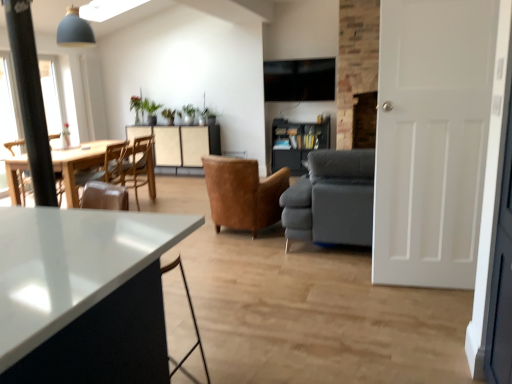
You are a GUI agent. You are given a task and a screenshot of the screen. Output one action in this format:
    pyautogui.click(x=<x>, y=<y>)
    Task: Click on the green leafy plant at center
    
    Given the screenshot: What is the action you would take?
    pyautogui.click(x=189, y=110)

I want to click on beige textured cabinet at center, so click(180, 143).

Describe the element at coordinates (104, 167) in the screenshot. I see `brown leather chair at left, positioned as the first chair in left-to-right order` at that location.

In order to face wooden chair at left, which ranks as the second chair in right-to-left order, should I rotate leftwards or rightwards?

You should look left and rotate roughly 16.334 degrees.

Where is `leather armchair at center, the third chair in the left-to-right sequence`? The width and height of the screenshot is (512, 384). leather armchair at center, the third chair in the left-to-right sequence is located at coordinates (243, 193).

This screenshot has height=384, width=512. In order to click on green leafy plant at center in this screenshot , I will do `click(189, 110)`.

From a real-world perspective, who is located lower, clear glass window at left or white matte door at right?

From a 3D spatial view, white matte door at right is below.

Is clear glass window at left surrounding white matte door at right?

That's incorrect, white matte door at right is not inside clear glass window at left.

Image resolution: width=512 pixels, height=384 pixels. Identify the location of window located above the white matte door at right (from a real-world perspective). (52, 93).

Is clear glass window at left at the left side of white matte door at right?

Yes.

In the scene shown: Could you tell me if clear glass window at left is facing dark wood bookshelf at center?

Yes.

Which is more to the right, clear glass window at left or dark wood bookshelf at center?

dark wood bookshelf at center.

Does point (59, 91) lie behind point (277, 122)?

No, it is not.

Is clear glass window at left directly adjacent to dark wood bookshelf at center?

No, clear glass window at left is not making contact with dark wood bookshelf at center.

Does point (135, 194) come closer to viewer compared to point (101, 178)?

Yes, it is.

Is wooden chair at left, which ranks as the second chair in right-to-left order, touching brown leather chair at left, positioned as the first chair in left-to-right order?

No, wooden chair at left, which ranks as the second chair in right-to-left order, is not next to brown leather chair at left, positioned as the first chair in left-to-right order.

Choose the correct answer: Is wooden chair at left, which ranks as the second chair in right-to-left order, inside brown leather chair at left, the 3th chair when ordered from right to left, or outside it?

wooden chair at left, which ranks as the second chair in right-to-left order, is not inside brown leather chair at left, the 3th chair when ordered from right to left, it's outside.

Is point (188, 112) less distant than point (175, 139)?

Yes, point (188, 112) is closer to viewer.

Is green leafy plant at center to the right of beige textured cabinet at center from the viewer's perspective?

Indeed, green leafy plant at center is positioned on the right side of beige textured cabinet at center.

How different are the orientations of green leafy plant at center and beige textured cabinet at center in degrees?

The angular difference between green leafy plant at center and beige textured cabinet at center is 1.93 degrees.

Locate an element on the screen. cabinetry that is under the green leafy plant at center (from a real-world perspective) is located at coordinates (180, 143).

Is point (138, 109) positioned after point (324, 134)?

No, it is in front of (324, 134).

From the image's perspective, is green matte plant at upper center located above or below dark wood bookshelf at center?

green matte plant at upper center is situated higher than dark wood bookshelf at center in the image.

Based on their sizes in the image, would you say green matte plant at upper center is bigger or smaller than dark wood bookshelf at center?

Considering their sizes, green matte plant at upper center takes up less space than dark wood bookshelf at center.

Which object is closer to the camera taking this photo, green matte plant at upper center or dark wood bookshelf at center?

Positioned in front is dark wood bookshelf at center.

Considering the positions of objects brown leather chair at left, positioned as the first chair in left-to-right order, and beige textured cabinet at center in the image provided, who is more to the right, brown leather chair at left, positioned as the first chair in left-to-right order, or beige textured cabinet at center?

Positioned to the right is beige textured cabinet at center.

Measure the distance from brown leather chair at left, the 3th chair when ordered from right to left, to beige textured cabinet at center.

brown leather chair at left, the 3th chair when ordered from right to left, is 1.53 meters from beige textured cabinet at center.

Find the location of a particular element. Image resolution: width=512 pixels, height=384 pixels. cabinetry behind the brown leather chair at left, positioned as the first chair in left-to-right order is located at coordinates (180, 143).

Considering the relative sizes of brown leather chair at left, positioned as the first chair in left-to-right order, and beige textured cabinet at center in the image provided, is brown leather chair at left, positioned as the first chair in left-to-right order, bigger than beige textured cabinet at center?

No, brown leather chair at left, positioned as the first chair in left-to-right order, is not bigger than beige textured cabinet at center.

I want to click on the 3rd chair counting from the right of the green matte plant at upper center, so click(x=243, y=193).

Is green matte plant at upper center taller or shorter than leather armchair at center, acting as the 1th chair starting from the right?

Considering their sizes, green matte plant at upper center has less height than leather armchair at center, acting as the 1th chair starting from the right.

Is green matte plant at upper center inside the boundaries of leather armchair at center, the third chair in the left-to-right sequence, or outside?

green matte plant at upper center is located beyond the bounds of leather armchair at center, the third chair in the left-to-right sequence.

Consider the image. Can you confirm if green matte plant at upper center is positioned to the right of leather armchair at center, the third chair in the left-to-right sequence?

Incorrect, green matte plant at upper center is not on the right side of leather armchair at center, the third chair in the left-to-right sequence.

Where is `window behind the white matte door at right`? This screenshot has width=512, height=384. window behind the white matte door at right is located at coordinates (52, 93).

What are the coordinates of `shelf on the right of clear glass window at left` in the screenshot? It's located at (297, 143).

Looking at the image, which one is located closer to green leafy plant at center, wooden chair at left, which ranks as the second chair in right-to-left order, or clear glass window at left?

wooden chair at left, which ranks as the second chair in right-to-left order.

Based on their spatial positions, is wooden chair at left, which is the second chair in left-to-right order, or green leafy plant at center closer to dark gray fabric couch at center?

Among the two, wooden chair at left, which is the second chair in left-to-right order, is located nearer to dark gray fabric couch at center.

Based on their spatial positions, is dark wood bookshelf at center or leather armchair at center, the third chair in the left-to-right sequence, further from dark gray fabric couch at center?

Among the two, dark wood bookshelf at center is located further to dark gray fabric couch at center.

From the image, which object appears to be nearer to white matte door at right, dark wood bookshelf at center or dark gray fabric couch at center?

dark gray fabric couch at center.

Which object lies further to the anchor point wooden chair at left, which ranks as the second chair in right-to-left order, leather armchair at center, the third chair in the left-to-right sequence, or green leafy plant at center?

Among the two, green leafy plant at center is located further to wooden chair at left, which ranks as the second chair in right-to-left order.

Estimate the real-world distances between objects in this image. Which object is closer to green matte plant at upper center, white matte door at right or dark wood bookshelf at center?

Based on the image, dark wood bookshelf at center appears to be nearer to green matte plant at upper center.

From the image, which object appears to be farther from white matte door at right, wooden chair at left, which is the second chair in left-to-right order, or beige textured cabinet at center?

beige textured cabinet at center is positioned further to the anchor white matte door at right.

Estimate the real-world distances between objects in this image. Which object is further from dark gray fabric couch at center, dark wood bookshelf at center or white matte door at right?

dark wood bookshelf at center is positioned further to the anchor dark gray fabric couch at center.

The width and height of the screenshot is (512, 384). In order to click on cabinetry between leather armchair at center, acting as the 1th chair starting from the right, and green leafy plant at center from front to back in this screenshot , I will do `click(180, 143)`.

Image resolution: width=512 pixels, height=384 pixels. In order to click on chair located between brown leather chair at left, positioned as the first chair in left-to-right order, and leather armchair at center, acting as the 1th chair starting from the right, in the left-right direction in this screenshot , I will do `click(131, 165)`.

Identify the location of houseplant located between white matte door at right and green leafy plant at center in the depth direction. (144, 109).

Find the location of `plant situated between clear glass window at left and white matte door at right from left to right`. plant situated between clear glass window at left and white matte door at right from left to right is located at coordinates (189, 110).